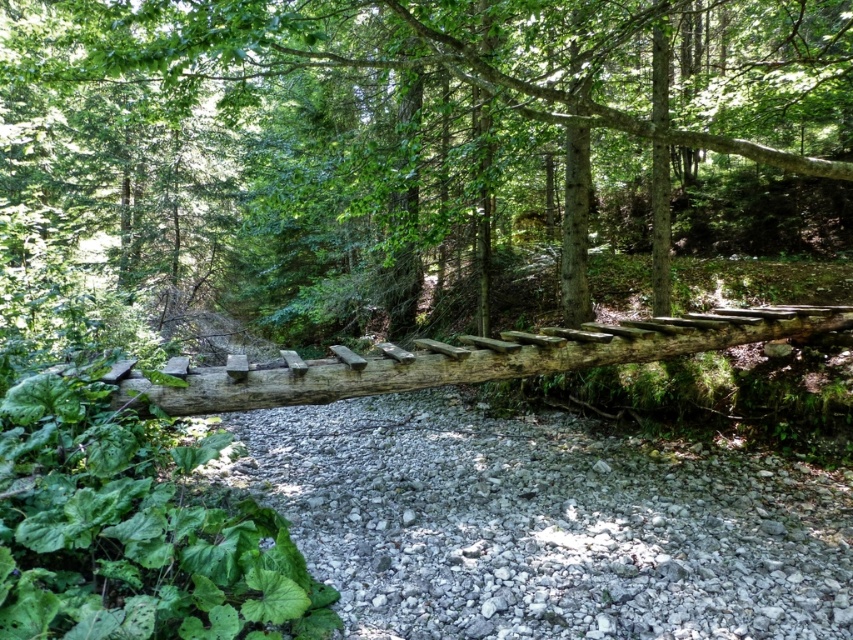
Is point (1, 20) behind point (561, 451)?

Yes, it is.

Can you confirm if smooth brown log at center is taller than gray gravel at center?

Correct, smooth brown log at center is much taller as gray gravel at center.

Between point (122, 67) and point (514, 465), which one is positioned behind?

Positioned behind is point (514, 465).

This screenshot has width=853, height=640. What are the coordinates of `smooth brown log at center` in the screenshot? It's located at (397, 132).